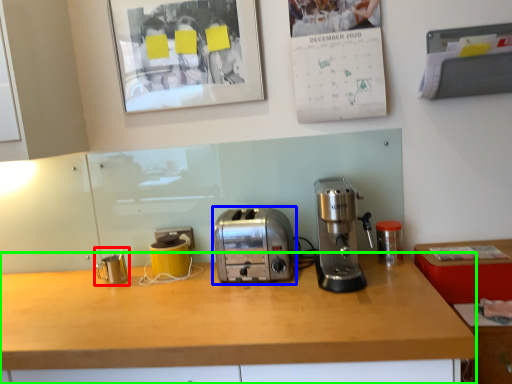
Question: Estimate the real-world distances between objects in this image. Which object is farther from appliance (highlighted by a red box), toaster (highlighted by a blue box) or desk (highlighted by a green box)?

Choices:
 (A) toaster
 (B) desk

Answer: (B)